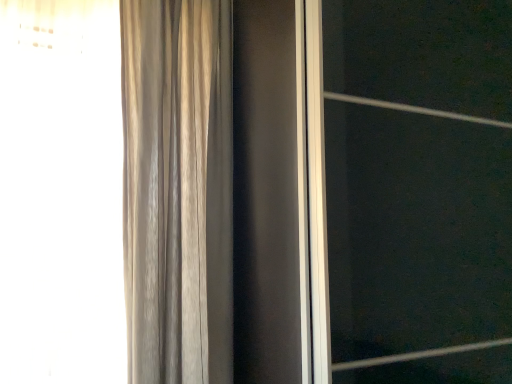
Question: Is transparent glass screen door at center at the left side of satin beige curtain at left?

Choices:
 (A) yes
 (B) no

Answer: (B)

Question: Can you confirm if transparent glass screen door at center is thinner than satin beige curtain at left?

Choices:
 (A) no
 (B) yes

Answer: (A)

Question: Considering the relative sizes of transparent glass screen door at center and satin beige curtain at left in the image provided, is transparent glass screen door at center smaller than satin beige curtain at left?

Choices:
 (A) yes
 (B) no

Answer: (B)

Question: Does transparent glass screen door at center have a greater width compared to satin beige curtain at left?

Choices:
 (A) no
 (B) yes

Answer: (B)

Question: Is transparent glass screen door at center in front of satin beige curtain at left?

Choices:
 (A) no
 (B) yes

Answer: (B)

Question: Is transparent glass screen door at center not inside satin beige curtain at left?

Choices:
 (A) yes
 (B) no

Answer: (A)

Question: From a real-world perspective, does satin beige curtain at left stand above transparent glass screen door at center?

Choices:
 (A) no
 (B) yes

Answer: (B)

Question: From the image's perspective, would you say satin beige curtain at left is positioned over transparent glass screen door at center?

Choices:
 (A) no
 (B) yes

Answer: (B)

Question: Can you see satin beige curtain at left touching transparent glass screen door at center?

Choices:
 (A) yes
 (B) no

Answer: (B)

Question: Is satin beige curtain at left taller than transparent glass screen door at center?

Choices:
 (A) no
 (B) yes

Answer: (A)

Question: Can you confirm if satin beige curtain at left is wider than transparent glass screen door at center?

Choices:
 (A) yes
 (B) no

Answer: (B)

Question: Can you confirm if satin beige curtain at left is bigger than transparent glass screen door at center?

Choices:
 (A) no
 (B) yes

Answer: (A)

Question: Is satin beige curtain at left wider or thinner than transparent glass screen door at center?

Choices:
 (A) thin
 (B) wide

Answer: (A)